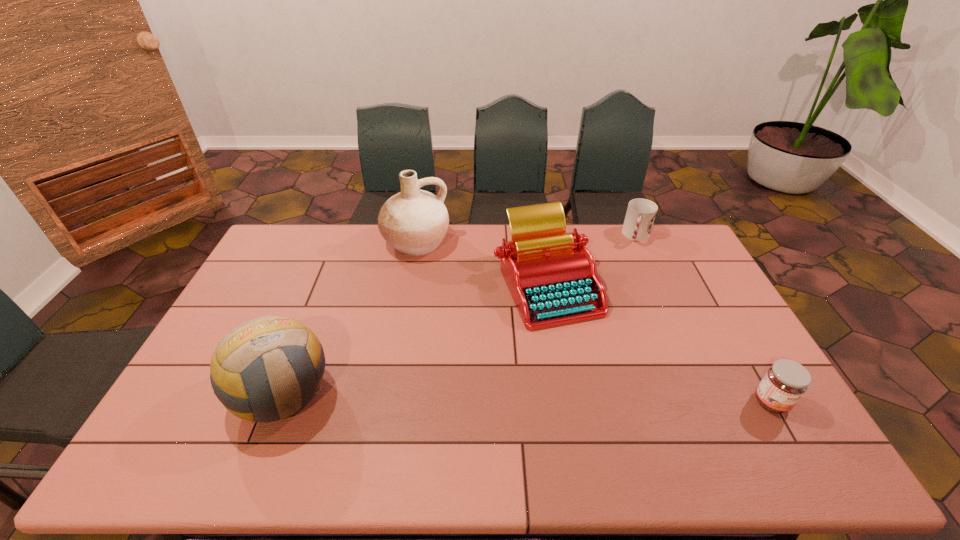
Where is `free space located 0.120m on the typing side of the third object from right to left`? Image resolution: width=960 pixels, height=540 pixels. free space located 0.120m on the typing side of the third object from right to left is located at coordinates (532, 360).

Find the location of a particular element. The image size is (960, 540). free space located 0.080m on the typing side of the third object from right to left is located at coordinates (534, 349).

Image resolution: width=960 pixels, height=540 pixels. Find the location of `vacant region located on the typing side of the third object from right to left`. vacant region located on the typing side of the third object from right to left is located at coordinates (524, 395).

Where is `free region located 0.200m on the handle side of the second object from right to left`? Image resolution: width=960 pixels, height=540 pixels. free region located 0.200m on the handle side of the second object from right to left is located at coordinates (627, 278).

Locate an element on the screen. This screenshot has height=540, width=960. free space located 0.190m on the handle side of the second object from right to left is located at coordinates (628, 276).

This screenshot has height=540, width=960. I want to click on vacant space located 0.340m on the handle side of the second object from right to left, so click(x=620, y=304).

At what (x,y) coordinates should I click in order to perform the action: click on free location located to pour from the handle of the pottery. Please return your answer as a coordinate pair (x, y). Looking at the image, I should click on (436, 293).

Identify the location of free space located 0.350m to pour from the handle of the pottery. The image size is (960, 540). (450, 332).

The image size is (960, 540). I want to click on free region located to pour from the handle of the pottery, so click(x=430, y=278).

I want to click on typewriter situated at the far edge, so click(552, 278).